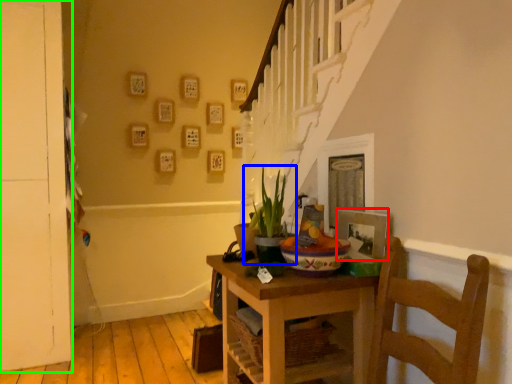
Question: Based on their relative distances, which object is nearer to picture frame (highlighted by a red box)? Choose from houseplant (highlighted by a blue box) and door (highlighted by a green box).

Choices:
 (A) houseplant
 (B) door

Answer: (A)